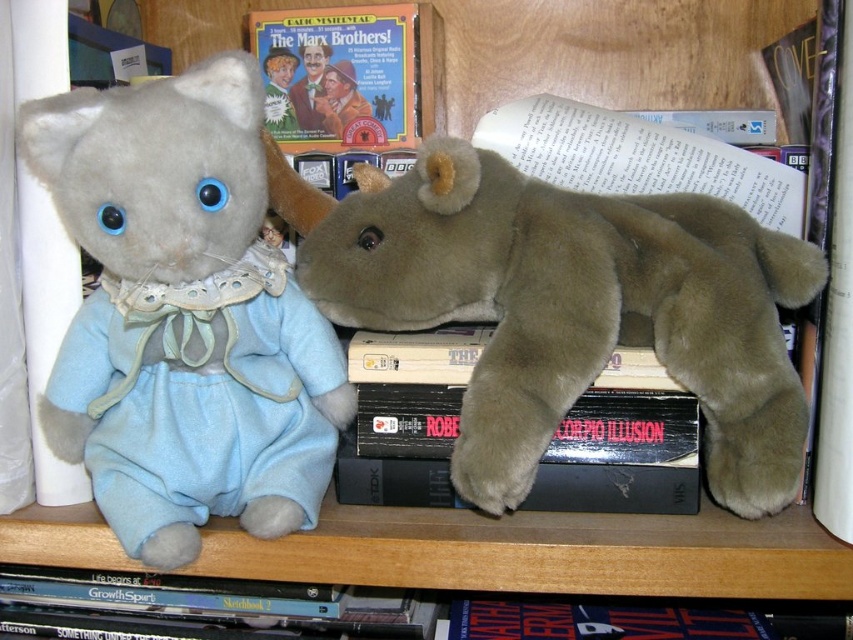
Between matte cardboard book at center and black matte book at center, which one has more height?

Standing taller between the two is matte cardboard book at center.

Where is `matte cardboard book at center`? matte cardboard book at center is located at coordinates (338, 76).

What do you see at coordinates (338, 76) in the screenshot?
I see `matte cardboard book at center` at bounding box center [338, 76].

Where is `matte cardboard book at center`? The width and height of the screenshot is (853, 640). matte cardboard book at center is located at coordinates (338, 76).

The height and width of the screenshot is (640, 853). Find the location of `brown plush bear at center`. brown plush bear at center is located at coordinates (575, 308).

Based on the photo, does brown plush bear at center appear over black matte book at center?

Yes.

Between point (387, 196) and point (434, 404), which one is positioned in front?

Point (387, 196) is more forward.

Find the location of `brown plush bear at center`. brown plush bear at center is located at coordinates (575, 308).

Who is positioned more to the right, matte blue plush cat at left or matte cardboard book at center?

matte cardboard book at center

Find the location of a particular element. Image resolution: width=853 pixels, height=640 pixels. matte blue plush cat at left is located at coordinates (183, 316).